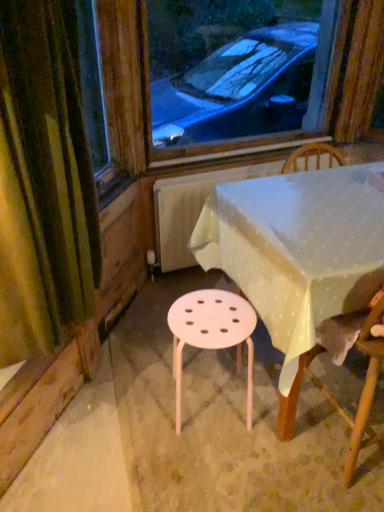
This screenshot has width=384, height=512. Identify the location of vacant space underneath pink plastic stool at center (from a real-world perspective). (206, 402).